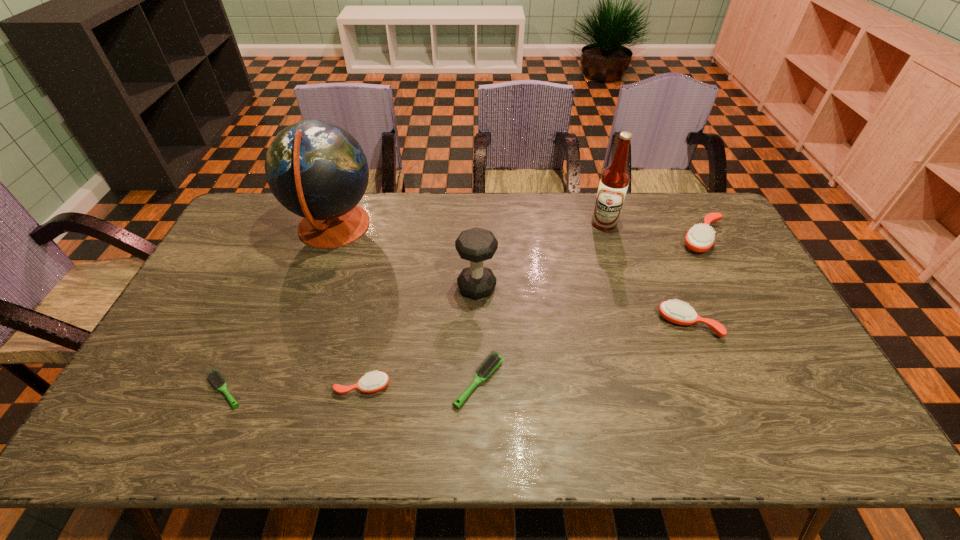
Locate an element on the screen. Image resolution: width=960 pixels, height=540 pixels. vacant area that satisfies the following two spatial constraints: 1. with the Americas facing the viewer on the seventh tallest object; 2. on the right side of the globe is located at coordinates (277, 382).

Find the location of `free location that satisfies the following two spatial constraints: 1. on the back side of the tallest hairbrush; 2. on the left side of the fourth tallest hairbrush`. free location that satisfies the following two spatial constraints: 1. on the back side of the tallest hairbrush; 2. on the left side of the fourth tallest hairbrush is located at coordinates (479, 239).

Where is `vacant space that satisfies the following two spatial constraints: 1. with the Americas facing the viewer on the second farthest hairbrush; 2. on the right side of the globe`? This screenshot has height=540, width=960. vacant space that satisfies the following two spatial constraints: 1. with the Americas facing the viewer on the second farthest hairbrush; 2. on the right side of the globe is located at coordinates (299, 324).

Where is `vacant area that satisfies the following two spatial constraints: 1. with the Americas facing the viewer on the globe; 2. on the back side of the gray dumbbell`? This screenshot has height=540, width=960. vacant area that satisfies the following two spatial constraints: 1. with the Americas facing the viewer on the globe; 2. on the back side of the gray dumbbell is located at coordinates (312, 287).